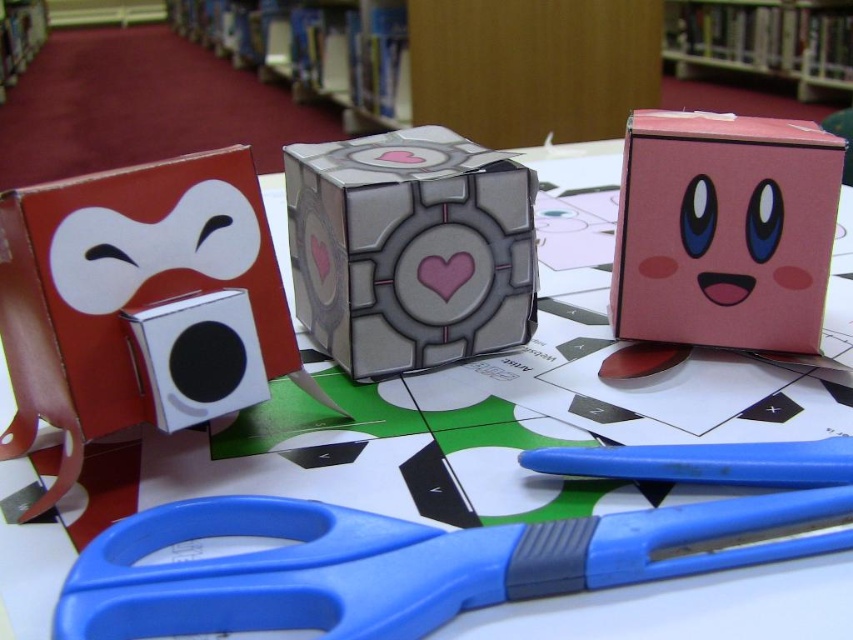
Between blue plastic scissors at lower center and white matte square at left, which one appears on the right side from the viewer's perspective?

blue plastic scissors at lower center is more to the right.

Between blue plastic scissors at lower center and white matte square at left, which one is positioned higher?

white matte square at left

Does point (785, 499) come farther from viewer compared to point (149, 266)?

No, (785, 499) is closer to viewer.

This screenshot has width=853, height=640. What are the coordinates of `blue plastic scissors at lower center` in the screenshot? It's located at coord(409,563).

Who is taller, metallic gray cube at center or wooden bookshelf at upper center?

With more height is wooden bookshelf at upper center.

Is metallic gray cube at center bigger than wooden bookshelf at upper center?

Actually, metallic gray cube at center might be smaller than wooden bookshelf at upper center.

This screenshot has height=640, width=853. Describe the element at coordinates (410, 250) in the screenshot. I see `metallic gray cube at center` at that location.

Where is `metallic gray cube at center`? The width and height of the screenshot is (853, 640). metallic gray cube at center is located at coordinates (410, 250).

Is point (383, 540) closer to camera compared to point (535, 321)?

That is True.

Does blue plastic scissors at lower center appear over metallic gray cube at center?

Actually, blue plastic scissors at lower center is below metallic gray cube at center.

Who is more forward, (453,564) or (527,195)?

Point (453,564)

Where is `blue plastic scissors at lower center`? The height and width of the screenshot is (640, 853). blue plastic scissors at lower center is located at coordinates (409, 563).